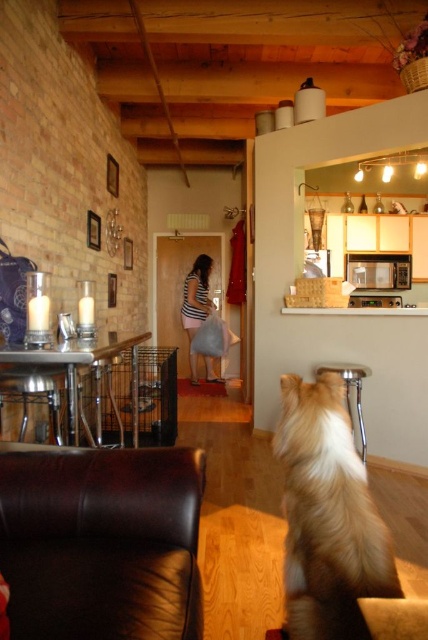
Question: Can you confirm if fluffy golden dog at center is positioned to the left of striped fabric dress at center?

Choices:
 (A) yes
 (B) no

Answer: (B)

Question: Observing the image, what is the correct spatial positioning of fluffy golden dog at center in reference to striped fabric dress at center?

Choices:
 (A) left
 (B) right

Answer: (B)

Question: Can you confirm if fluffy golden dog at center is smaller than striped fabric dress at center?

Choices:
 (A) no
 (B) yes

Answer: (B)

Question: Which of the following is the closest to the observer?

Choices:
 (A) (347, 369)
 (B) (198, 316)

Answer: (A)

Question: Which object is the farthest from the fluffy golden dog at center?

Choices:
 (A) striped fabric dress at center
 (B) metallic silver stool at lower center

Answer: (A)

Question: Among these objects, which one is nearest to the camera?

Choices:
 (A) fluffy golden dog at center
 (B) metallic silver stool at lower center

Answer: (A)